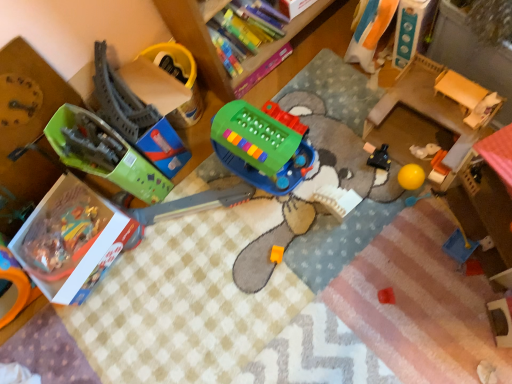
Question: Considering the relative sizes of wooden bookshelf at upper center and green plastic toy at center, arranged as the 4th toy when viewed from the right, in the image provided, is wooden bookshelf at upper center smaller than green plastic toy at center, arranged as the 4th toy when viewed from the right,?

Choices:
 (A) no
 (B) yes

Answer: (A)

Question: Would you say wooden bookshelf at upper center is outside green plastic toy at center, placed as the third toy when sorted from left to right?

Choices:
 (A) no
 (B) yes

Answer: (B)

Question: Is wooden bookshelf at upper center oriented away from green plastic toy at center, placed as the third toy when sorted from left to right?

Choices:
 (A) yes
 (B) no

Answer: (B)

Question: Can you confirm if wooden bookshelf at upper center is shorter than green plastic toy at center, placed as the third toy when sorted from left to right?

Choices:
 (A) yes
 (B) no

Answer: (B)

Question: Does wooden bookshelf at upper center appear on the left side of green plastic toy at center, placed as the third toy when sorted from left to right?

Choices:
 (A) no
 (B) yes

Answer: (A)

Question: Is wooden bookshelf at upper center closer to the viewer compared to green plastic toy at center, arranged as the 4th toy when viewed from the right?

Choices:
 (A) no
 (B) yes

Answer: (B)

Question: From a real-world perspective, is green plastic toy at center, arranged as the 4th toy when viewed from the right, located higher than white cardboard box at left, placed as the first box when sorted from bottom to top?

Choices:
 (A) no
 (B) yes

Answer: (B)

Question: Is white cardboard box at left, marked as the second box in a right-to-left arrangement, a part of green plastic toy at center, placed as the third toy when sorted from left to right?

Choices:
 (A) yes
 (B) no

Answer: (B)

Question: Is the position of green plastic toy at center, arranged as the 4th toy when viewed from the right, more distant than that of white cardboard box at left, marked as the second box in a right-to-left arrangement?

Choices:
 (A) no
 (B) yes

Answer: (A)

Question: Is green plastic toy at center, arranged as the 4th toy when viewed from the right, next to white cardboard box at left, placed as the first box when sorted from bottom to top?

Choices:
 (A) no
 (B) yes

Answer: (A)

Question: From the image's perspective, is green plastic toy at center, placed as the third toy when sorted from left to right, on white cardboard box at left, marked as the second box in a right-to-left arrangement?

Choices:
 (A) yes
 (B) no

Answer: (A)

Question: Does green plastic toy at center, placed as the third toy when sorted from left to right, have a lesser width compared to white cardboard box at left, the first box viewed from the left?

Choices:
 (A) no
 (B) yes

Answer: (A)

Question: Is wooden changing table at right positioned before wooden bookshelf at upper center?

Choices:
 (A) no
 (B) yes

Answer: (A)